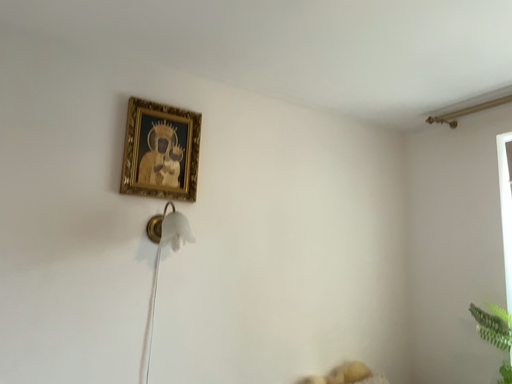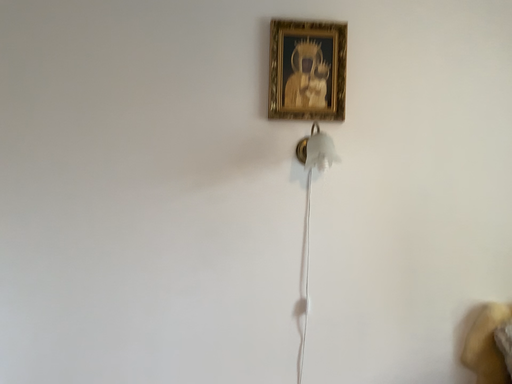
Question: How did the camera likely rotate when shooting the video?

Choices:
 (A) rotated upward
 (B) rotated downward

Answer: (B)